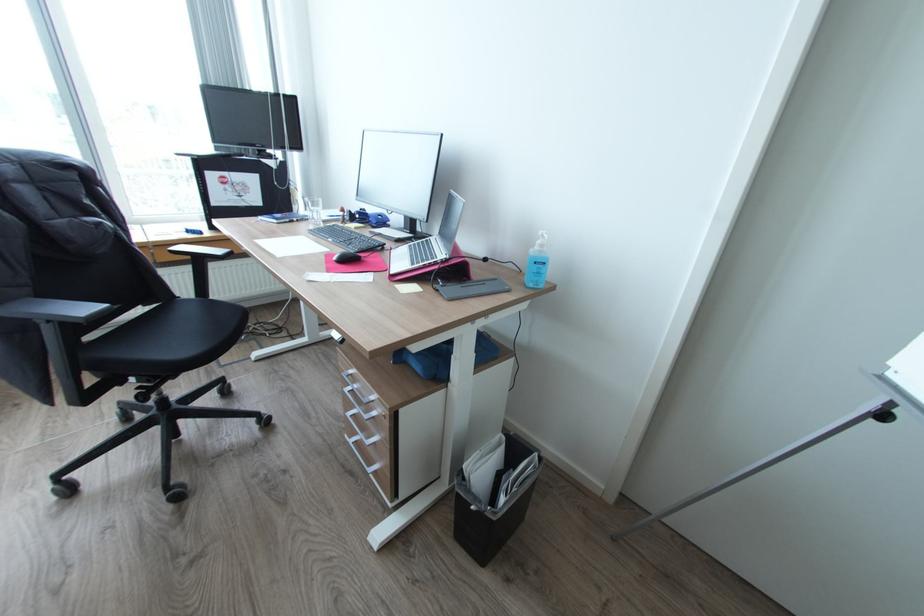
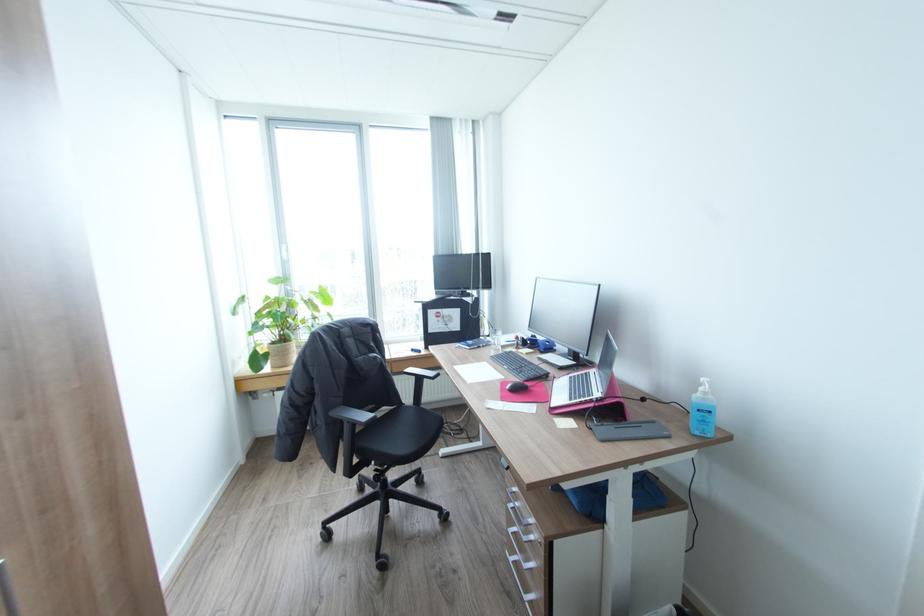
The point at (545,245) is marked in the first image. Where is the corresponding point in the second image?

(710, 392)